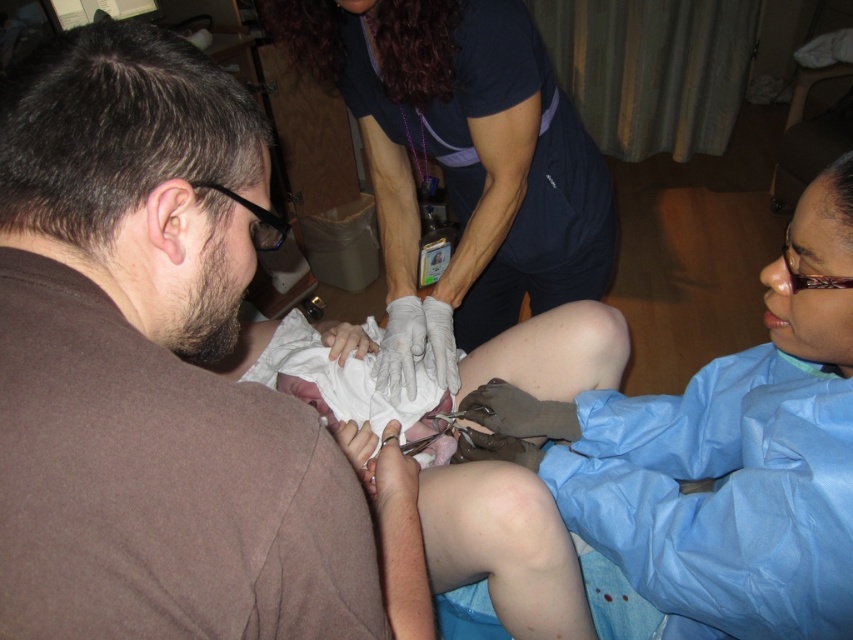
You are a medical student observing the procedure. You notice two points marked in the image. The first point is at coordinates point (235, 426) and the second is at point (590, 216). Which point is closer to the healthcare provider performing the procedure?

Point (235, 426) is closer to the healthcare provider performing the procedure because it is in front of point (590, 216).

Based on the scene described, which object is positioned lower between the blue latex gloves at upper center and the matte blue scrubs at center?

The blue latex gloves at upper center are positioned lower than the matte blue scrubs at center.

You are a medical student observing a procedure. You notice the blue latex gloves at upper center and the matte blue scrubs at center. Which item is narrower in width?

The blue latex gloves at upper center are narrower in width compared to the matte blue scrubs at center.